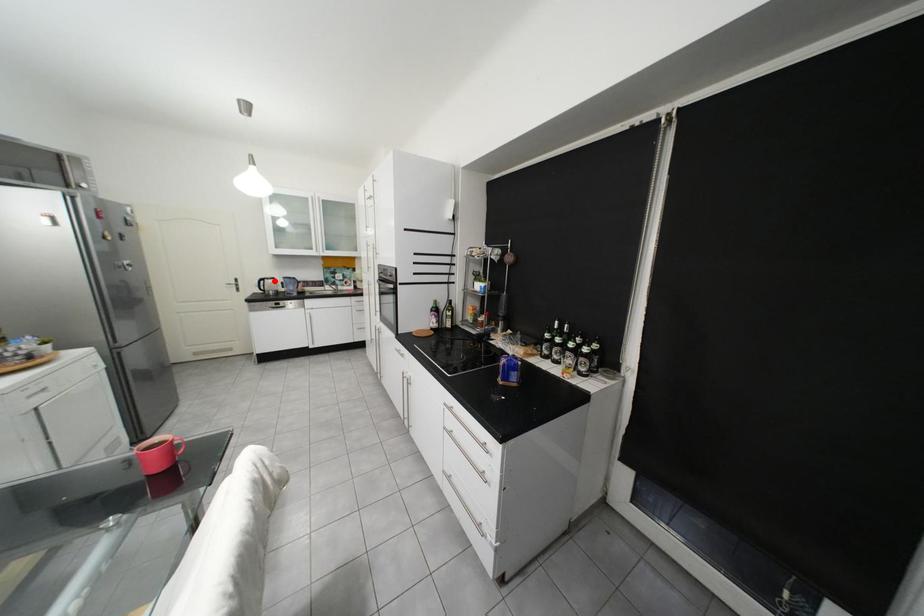
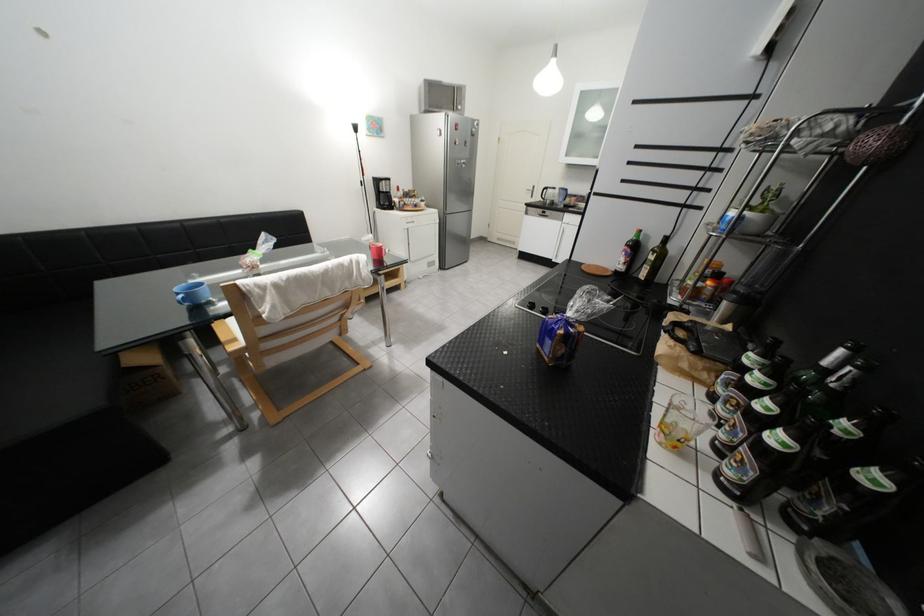
In the second image, find the point that corresponds to the highlighted location in the first image.

(557, 190)